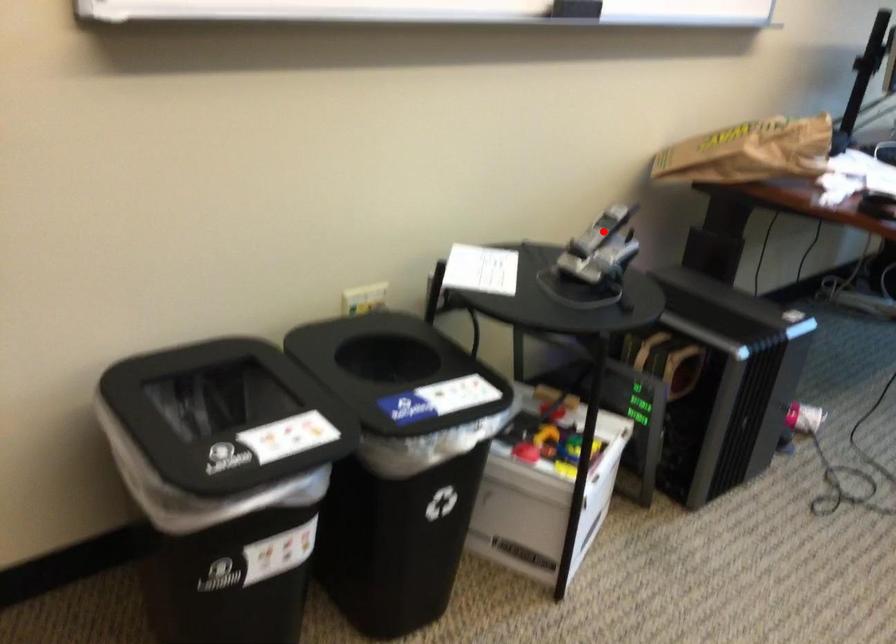
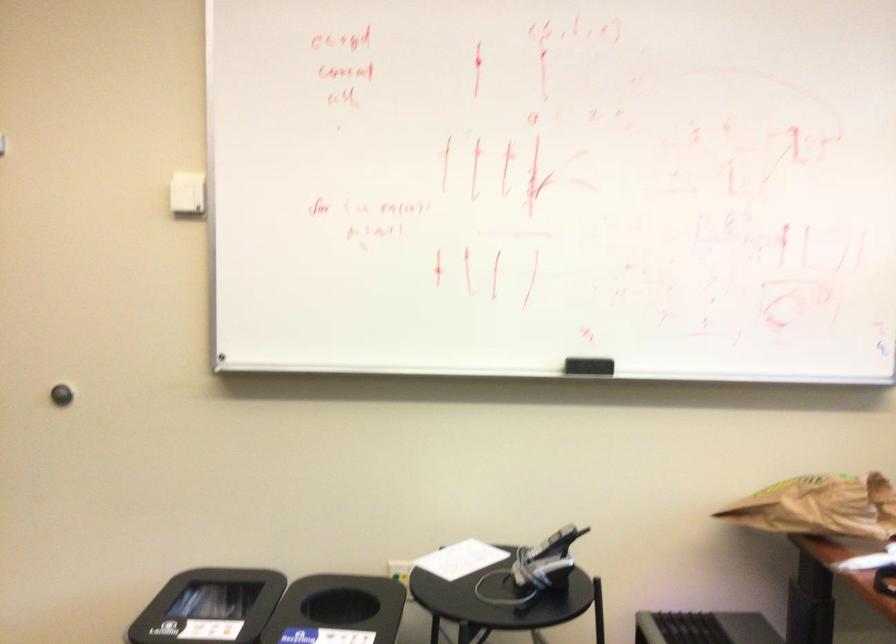
Question: I am providing you with two images of the same scene from different viewpoints. Given a red point in image1, look at the same physical point in image2. Is it:

Choices:
 (A) Closer to the viewpoint
 (B) Farther from the viewpoint

Answer: (B)